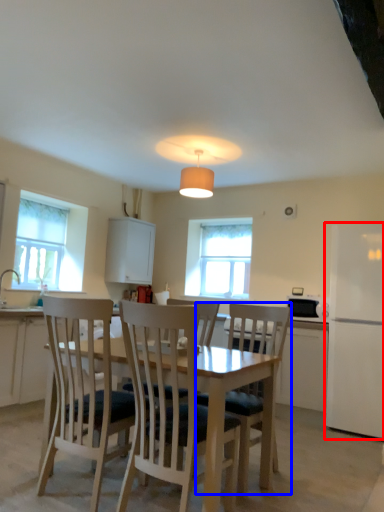
Question: Which point is closer to the camera, fridge (highlighted by a red box) or chair (highlighted by a blue box)?

Choices:
 (A) fridge
 (B) chair

Answer: (B)